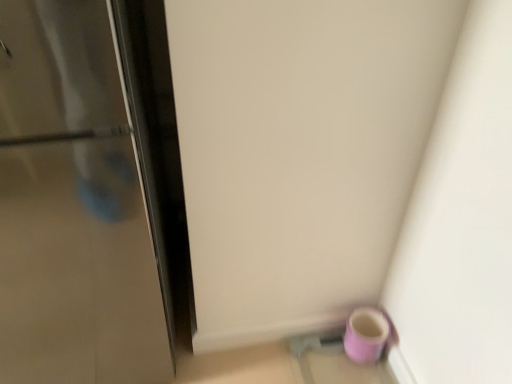
Question: From a real-world perspective, is glossy metallic door at left over matte purple mug at lower right?

Choices:
 (A) no
 (B) yes

Answer: (B)

Question: Is glossy metallic door at left bigger than matte purple mug at lower right?

Choices:
 (A) no
 (B) yes

Answer: (B)

Question: Can you confirm if glossy metallic door at left is wider than matte purple mug at lower right?

Choices:
 (A) no
 (B) yes

Answer: (B)

Question: From the image's perspective, is glossy metallic door at left located above matte purple mug at lower right?

Choices:
 (A) yes
 (B) no

Answer: (A)

Question: Is glossy metallic door at left not close to matte purple mug at lower right?

Choices:
 (A) yes
 (B) no

Answer: (B)

Question: From a real-world perspective, is glossy metallic door at left located beneath matte purple mug at lower right?

Choices:
 (A) yes
 (B) no

Answer: (B)

Question: Is matte purple mug at lower right bigger than glossy metallic door at left?

Choices:
 (A) yes
 (B) no

Answer: (B)

Question: Is matte purple mug at lower right smaller than glossy metallic door at left?

Choices:
 (A) no
 (B) yes

Answer: (B)

Question: Is matte purple mug at lower right turned away from glossy metallic door at left?

Choices:
 (A) no
 (B) yes

Answer: (A)

Question: Does matte purple mug at lower right touch glossy metallic door at left?

Choices:
 (A) yes
 (B) no

Answer: (B)

Question: From the image's perspective, is matte purple mug at lower right above glossy metallic door at left?

Choices:
 (A) no
 (B) yes

Answer: (A)

Question: From a real-world perspective, is matte purple mug at lower right positioned under glossy metallic door at left based on gravity?

Choices:
 (A) yes
 (B) no

Answer: (A)

Question: Is glossy metallic door at left inside the boundaries of matte purple mug at lower right, or outside?

Choices:
 (A) outside
 (B) inside

Answer: (A)